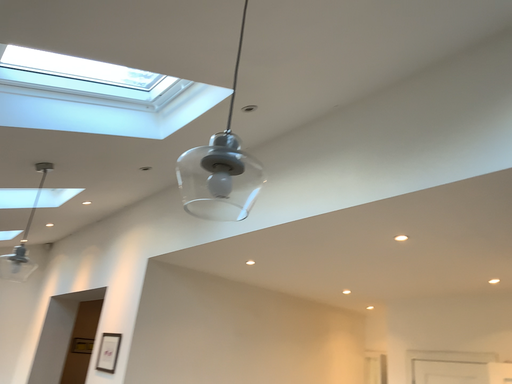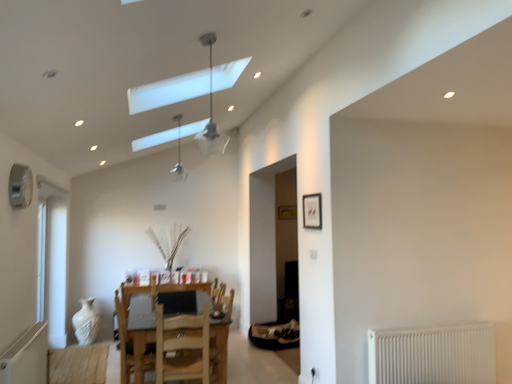
Question: Which way did the camera rotate in the video?

Choices:
 (A) rotated downward
 (B) rotated upward

Answer: (A)